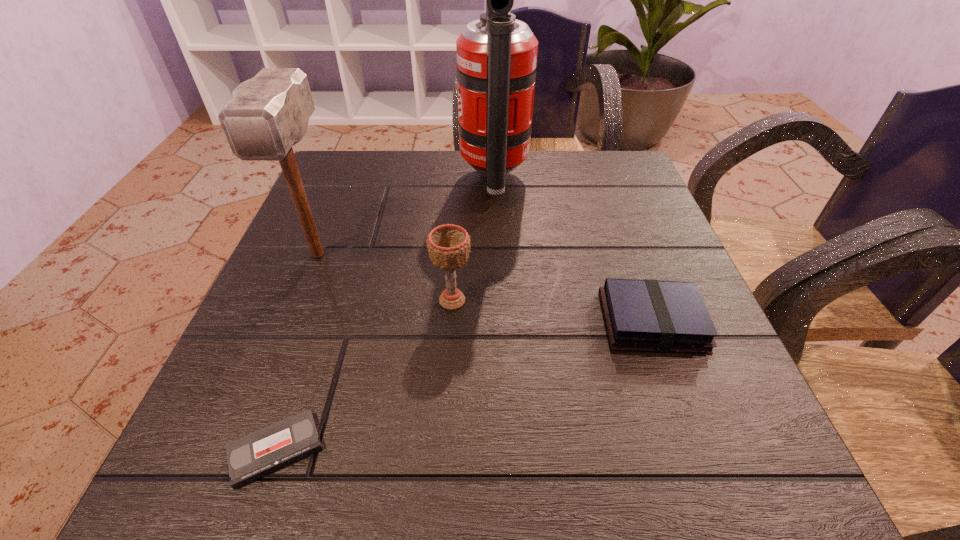
In order to click on object situated at the right edge in this screenshot , I will do `click(660, 316)`.

Where is `object positioned at the near left corner`? This screenshot has width=960, height=540. object positioned at the near left corner is located at coordinates (255, 455).

In order to click on free spot at the far edge of the desktop in this screenshot , I will do `click(531, 150)`.

Where is `free space at the near edge of the desktop`? This screenshot has width=960, height=540. free space at the near edge of the desktop is located at coordinates (347, 466).

Locate an element on the screen. vacant space at the left edge of the desktop is located at coordinates (254, 310).

The height and width of the screenshot is (540, 960). I want to click on vacant space at the right edge, so click(676, 256).

The image size is (960, 540). Find the location of `blank space at the far left corner`. blank space at the far left corner is located at coordinates (311, 198).

What are the coordinates of `free space at the near left corner` in the screenshot? It's located at (178, 492).

This screenshot has width=960, height=540. I want to click on vacant space at the far right corner, so click(606, 193).

Find the location of a particular element. The image size is (960, 540). unoccupied area between the fire extinguisher and the third tallest object is located at coordinates (473, 240).